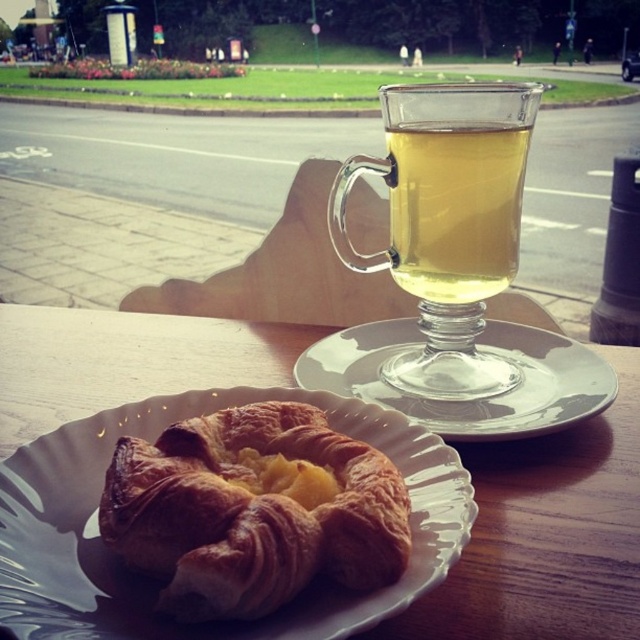
Which is in front, point (621, 356) or point (275, 470)?

Point (275, 470) is in front.

Is point (284, 358) positioned behind point (244, 481)?

Yes, it is behind point (244, 481).

I want to click on wooden table at center, so click(547, 534).

Is transparent glass saucer at center positioned before golden flaky croissant at lower left?

That is False.

Who is more distant from viewer, [536,422] or [236,483]?

Positioned behind is point [536,422].

Where is `transparent glass saucer at center`? transparent glass saucer at center is located at coordinates (470, 397).

Between golden brown flaky croissant at lower left and transparent glass saucer at center, which one is positioned higher?

transparent glass saucer at center

Is point (282, 456) closer to viewer compared to point (369, 339)?

Yes, point (282, 456) is in front of point (369, 339).

Does point (396, 536) come farther from viewer compared to point (372, 339)?

No, (396, 536) is in front of (372, 339).

Locate an element on the screen. This screenshot has width=640, height=640. golden brown flaky croissant at lower left is located at coordinates (252, 509).